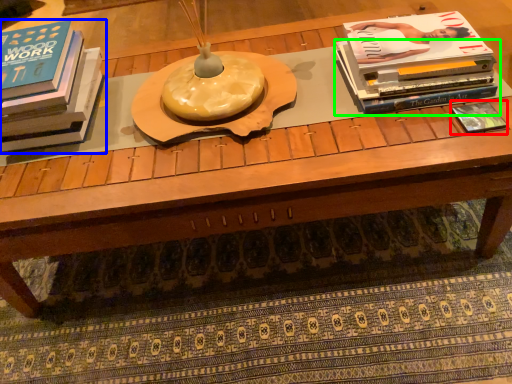
Question: Which is farther away from book (highlighted by a red box)? book (highlighted by a blue box) or book (highlighted by a green box)?

Choices:
 (A) book
 (B) book

Answer: (A)